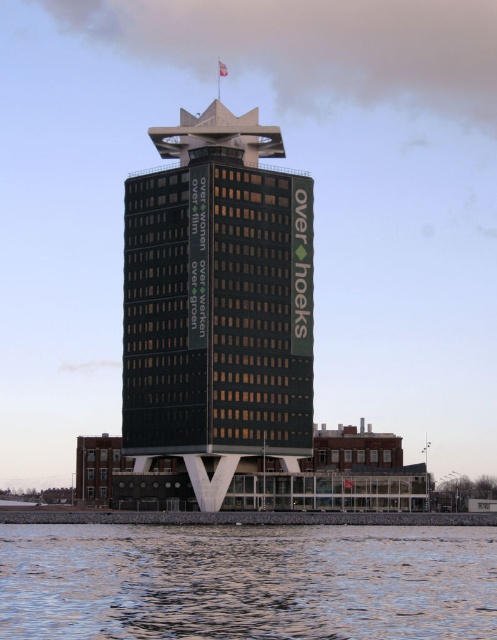
Question: Is green glass building at center bigger than clear water at lower left?

Choices:
 (A) no
 (B) yes

Answer: (A)

Question: Among these objects, which one is farthest from the camera?

Choices:
 (A) clear water at lower left
 (B) green glass building at center

Answer: (B)

Question: Does green glass building at center have a larger size compared to clear water at lower left?

Choices:
 (A) yes
 (B) no

Answer: (B)

Question: Which point is closer to the camera?

Choices:
 (A) (145, 624)
 (B) (165, 440)

Answer: (A)

Question: Which of the following is the closest to the observer?

Choices:
 (A) green glass building at center
 (B) clear water at lower left

Answer: (B)

Question: Where is green glass building at center located in relation to clear water at lower left in the image?

Choices:
 (A) left
 (B) right

Answer: (A)